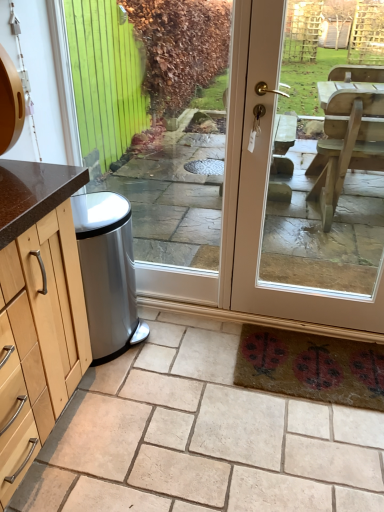
Identify the location of clear glass door at center. The image size is (384, 512). (157, 116).

Locate an element on the screen. This screenshot has height=512, width=384. satin silver trash can at lower left is located at coordinates (282, 196).

From the image's perspective, is clear glass door at center located beneath matte beige door at center?

Incorrect, from the image's perspective, clear glass door at center is higher than matte beige door at center.

Can you tell me how much clear glass door at center and matte beige door at center differ in facing direction?

The angle between the facing direction of clear glass door at center and the facing direction of matte beige door at center is 0.00395 degrees.

Is matte beige door at center at the back of clear glass door at center?

clear glass door at center does not have its back to matte beige door at center.

Would you consider satin silver trash can at lower left to be distant from clear glass door at center?

Yes, satin silver trash can at lower left and clear glass door at center are located far from each other.

Considering the sizes of objects satin silver trash can at lower left and clear glass door at center in the image provided, who is taller, satin silver trash can at lower left or clear glass door at center?

satin silver trash can at lower left is taller.

Is satin silver trash can at lower left wider than clear glass door at center?

No.

In the scene shown: Can you confirm if satin silver trash can at lower left is bigger than clear glass door at center?

Yes.

Find the location of a particular element. screen door to the left of matte beige door at center is located at coordinates (282, 196).

From the image's perspective, which is below, satin silver trash can at lower left or matte beige door at center?

matte beige door at center.

Based on their sizes in the image, would you say satin silver trash can at lower left is bigger or smaller than matte beige door at center?

In the image, satin silver trash can at lower left appears to be larger than matte beige door at center.

Is matte beige door at center oriented away from satin silver trash can at lower left?

That's right, matte beige door at center is facing away from satin silver trash can at lower left.

In terms of height, does matte beige door at center look taller or shorter compared to satin silver trash can at lower left?

In the image, matte beige door at center appears to be shorter than satin silver trash can at lower left.

Which is farther from the camera, [239,192] or [336,275]?

Positioned behind is point [336,275].

In the image, is matte beige door at center positioned in front of or behind satin silver trash can at lower left?

Visually, matte beige door at center is located in front of satin silver trash can at lower left.

Is clear glass door at center next to satin silver trash can at lower left?

No, clear glass door at center is not next to satin silver trash can at lower left.

Is clear glass door at center to the left or to the right of satin silver trash can at lower left in the image?

Based on their positions, clear glass door at center is located to the left of satin silver trash can at lower left.

From a real-world perspective, which is physically below, clear glass door at center or satin silver trash can at lower left?

satin silver trash can at lower left is physically lower.

Is clear glass door at center looking in the opposite direction of satin silver trash can at lower left?

clear glass door at center is not turned away from satin silver trash can at lower left.

Is point (269, 123) positioned after point (218, 177)?

That is False.

Is matte beige door at center bigger than clear glass door at center?

Indeed, matte beige door at center has a larger size compared to clear glass door at center.

What are the coordinates of `window above the matte beige door at center (from the image's perspective)` in the screenshot? It's located at (157, 116).

What are the coordinates of `door below the clear glass door at center (from the image's perspective)` in the screenshot? It's located at (265, 206).

Locate an element on the screen. This screenshot has height=512, width=384. screen door that is in front of the clear glass door at center is located at coordinates (282, 196).

In the scene shown: When comparing their distances from satin silver trash can at lower left, does matte beige door at center or clear glass door at center seem further?

Based on the image, clear glass door at center appears to be further to satin silver trash can at lower left.

Which object lies nearer to the anchor point matte beige door at center, clear glass door at center or satin silver trash can at lower left?

satin silver trash can at lower left lies closer to matte beige door at center than the other object.

Based on their spatial positions, is satin silver trash can at lower left or clear glass door at center further from matte beige door at center?

clear glass door at center.

In the scene shown: Which object lies further to the anchor point clear glass door at center, satin silver trash can at lower left or matte beige door at center?

Based on the image, matte beige door at center appears to be further to clear glass door at center.

Based on their spatial positions, is matte beige door at center or satin silver trash can at lower left further from clear glass door at center?

matte beige door at center is further to clear glass door at center.

Looking at the image, which one is located closer to satin silver trash can at lower left, clear glass door at center or matte beige door at center?

matte beige door at center lies closer to satin silver trash can at lower left than the other object.

Where is `screen door situated between clear glass door at center and matte beige door at center from left to right`? The height and width of the screenshot is (512, 384). screen door situated between clear glass door at center and matte beige door at center from left to right is located at coordinates (282, 196).